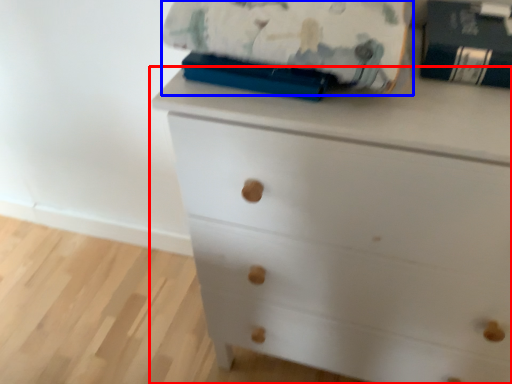
Question: Which of the following is the closest to the observer, chest of drawers (highlighted by a red box) or blanket (highlighted by a blue box)?

Choices:
 (A) chest of drawers
 (B) blanket

Answer: (A)